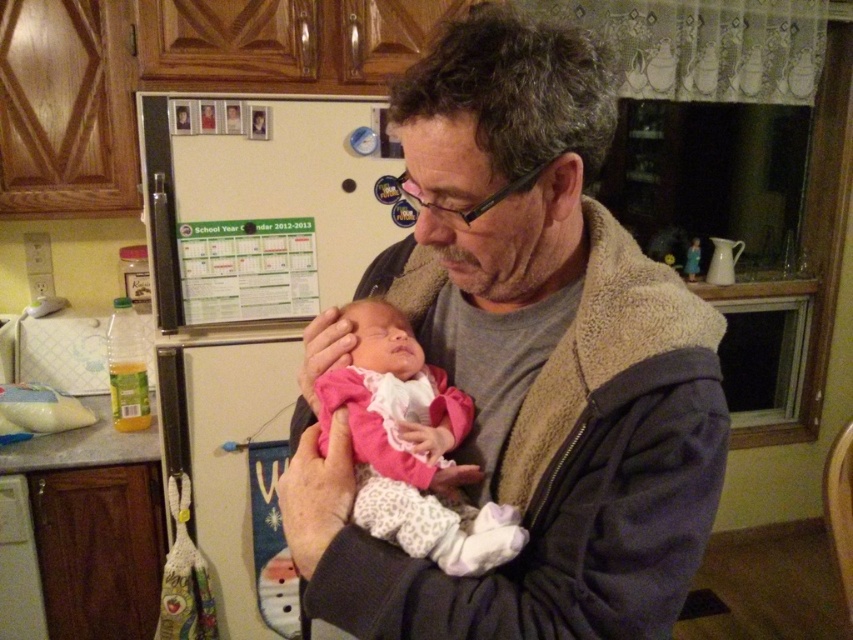
Question: Which point appears farthest from the camera in this image?

Choices:
 (A) (347, 403)
 (B) (538, 221)

Answer: (A)

Question: Is gray fleece jacket at center further to camera compared to pink fleece baby at center?

Choices:
 (A) yes
 (B) no

Answer: (B)

Question: Which point is farther to the camera?

Choices:
 (A) (590, 38)
 (B) (357, 369)

Answer: (B)

Question: Does gray fleece jacket at center have a greater width compared to pink fleece baby at center?

Choices:
 (A) no
 (B) yes

Answer: (B)

Question: Does gray fleece jacket at center lie in front of pink fleece baby at center?

Choices:
 (A) yes
 (B) no

Answer: (A)